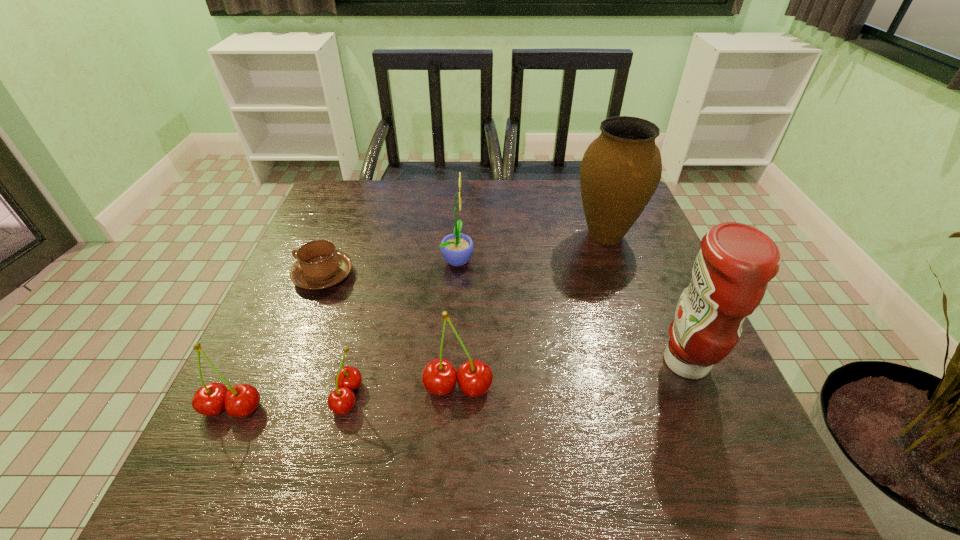
What are the coordinates of `free space located on the front-facing side of the sunflower` in the screenshot? It's located at (502, 259).

Image resolution: width=960 pixels, height=540 pixels. I want to click on vacant space located on the front of the urn, so click(624, 287).

This screenshot has width=960, height=540. Find the location of `vacant region located 0.170m on the back of the condiment`. vacant region located 0.170m on the back of the condiment is located at coordinates pos(651,279).

Locate an element on the screen. object located in the far edge section of the desktop is located at coordinates (620, 171).

Where is `condiment located in the near edge section of the desktop`? This screenshot has width=960, height=540. condiment located in the near edge section of the desktop is located at coordinates (730, 275).

Identify the location of cherry that is at the left edge. (241, 400).

At what (x,y) coordinates should I click in order to perform the action: click on cappuccino at the left edge. Please return your answer as a coordinate pair (x, y). The width and height of the screenshot is (960, 540). Looking at the image, I should click on (319, 265).

At what (x,y) coordinates should I click in order to perform the action: click on urn that is at the right edge. Please return your answer as a coordinate pair (x, y). This screenshot has width=960, height=540. Looking at the image, I should click on (620, 171).

This screenshot has width=960, height=540. Identify the location of condiment that is at the right edge. (730, 275).

At what (x,y) coordinates should I click in order to perform the action: click on object that is positioned at the near left corner. Please return your answer as a coordinate pair (x, y). The image size is (960, 540). Looking at the image, I should click on (241, 400).